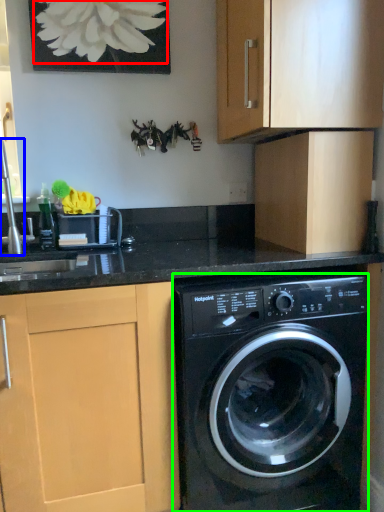
Question: Considering the real-world distances, which object is farthest from flower (highlighted by a red box)? faucet (highlighted by a blue box) or washing machine (highlighted by a green box)?

Choices:
 (A) faucet
 (B) washing machine

Answer: (B)